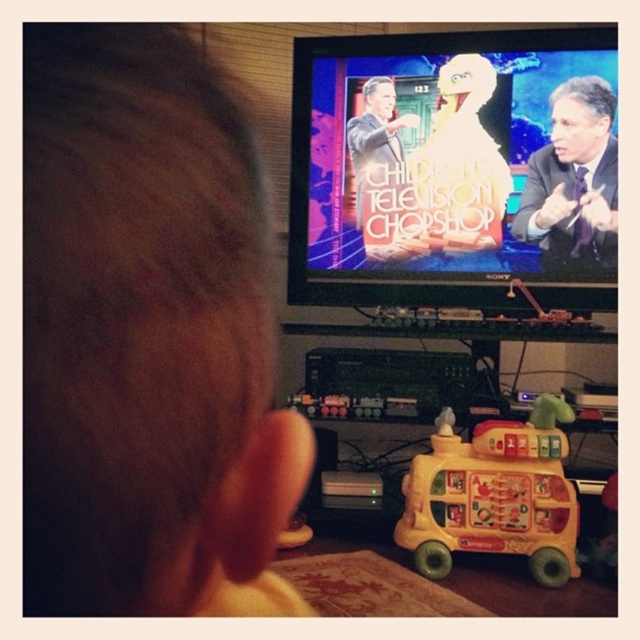
Can you confirm if brown matte hair at upper left is smaller than yellow plastic bus at lower center?

Correct, brown matte hair at upper left occupies less space than yellow plastic bus at lower center.

How much distance is there between brown matte hair at upper left and yellow plastic bus at lower center?

1.35 meters

The image size is (640, 640). What are the coordinates of `brown matte hair at upper left` in the screenshot? It's located at (147, 337).